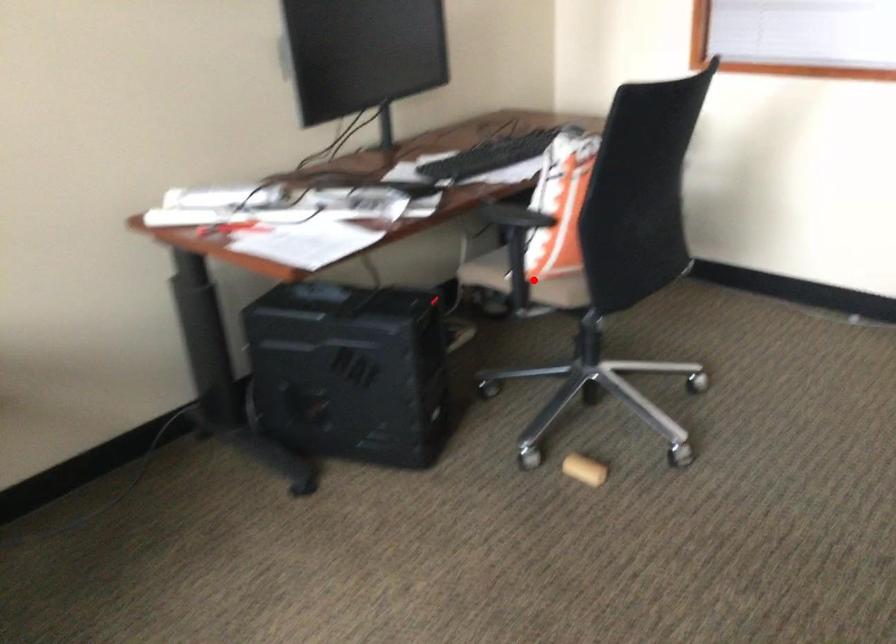
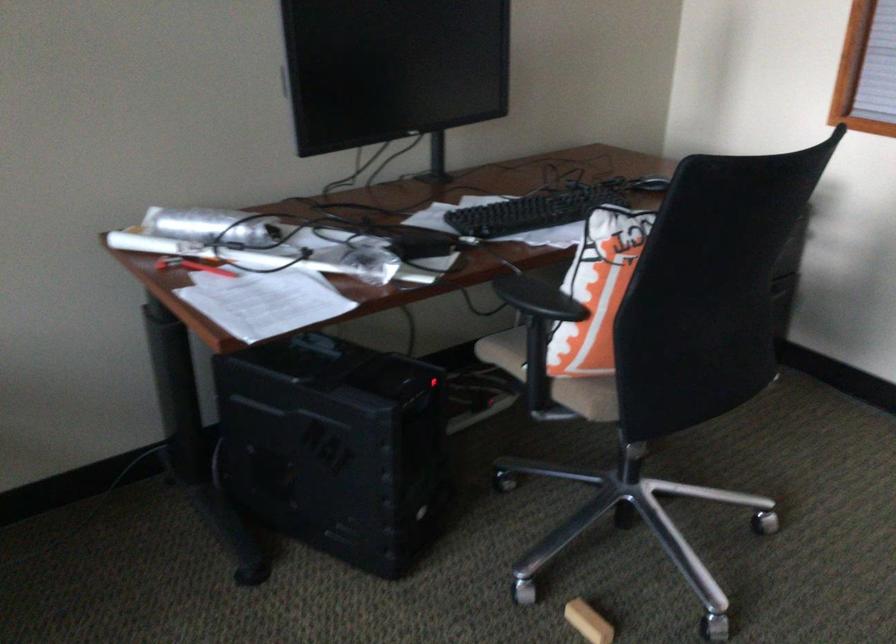
Question: I am providing you with two images of the same scene from different viewpoints. A red point is shown in image1. For the corresponding object point in image2, is it positioned nearer or farther from the camera?

Choices:
 (A) Nearer
 (B) Farther

Answer: (A)